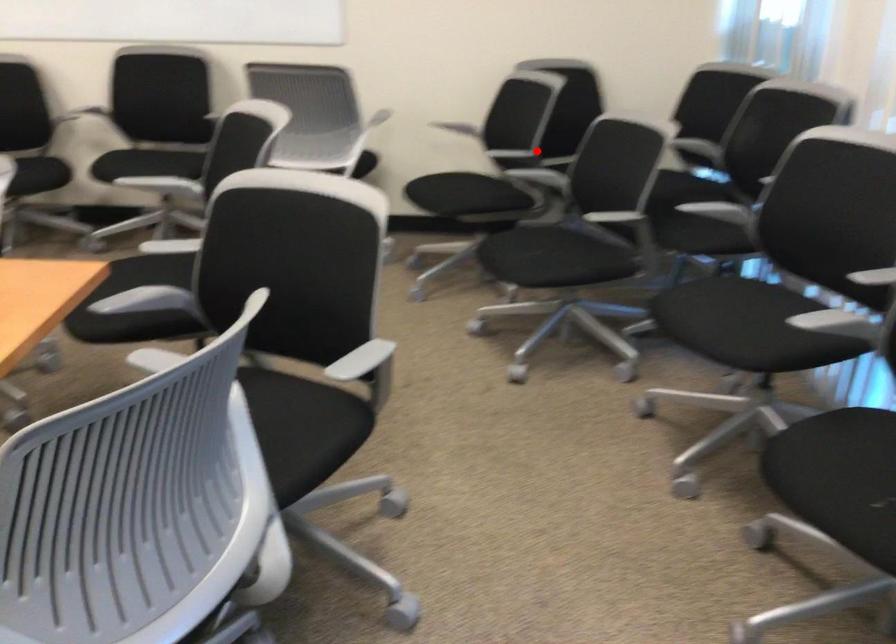
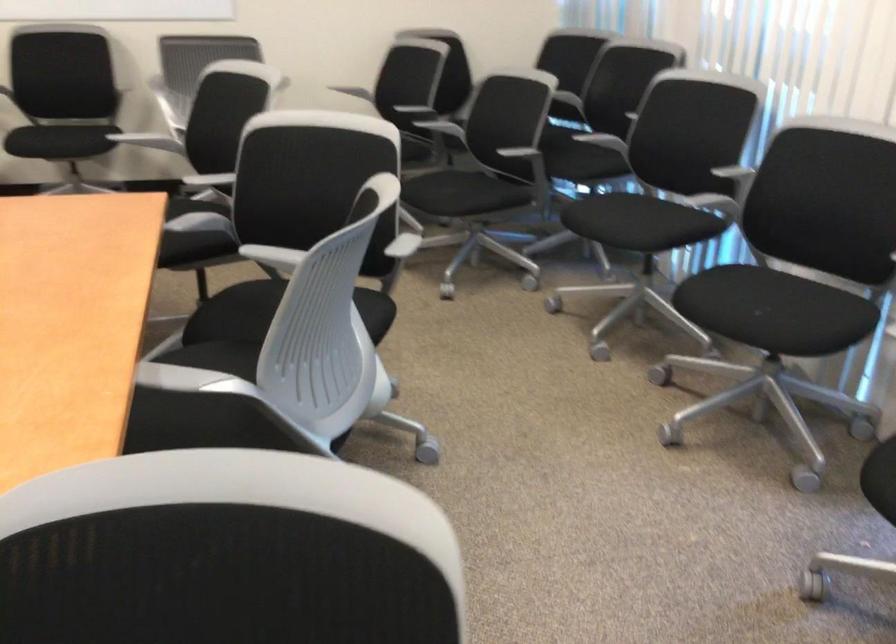
Question: I am providing you with two images of the same scene from different viewpoints. A red point is shown in image1. For the corresponding object point in image2, is it positioned nearer or farther from the camera?

Choices:
 (A) Nearer
 (B) Farther

Answer: (B)